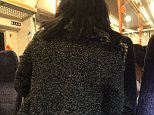
Find the location of a particular element. This screenshot has width=154, height=115. coat is located at coordinates (72, 60).